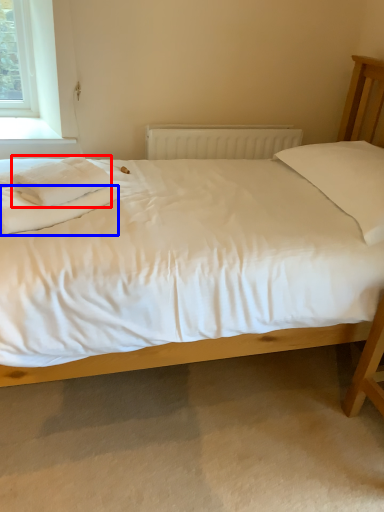
Question: Among these objects, which one is nearest to the camera, material (highlighted by a red box) or sheet (highlighted by a blue box)?

Choices:
 (A) material
 (B) sheet

Answer: (B)